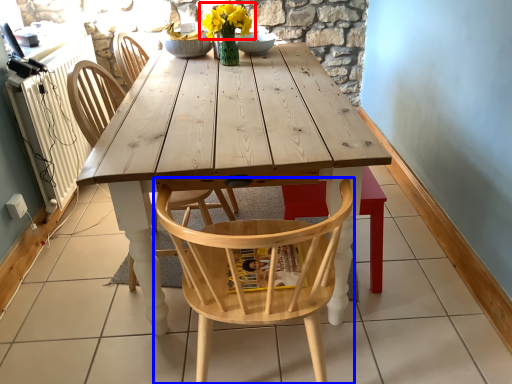
Question: Which object is further to the camera taking this photo, flower (highlighted by a red box) or chair (highlighted by a blue box)?

Choices:
 (A) flower
 (B) chair

Answer: (A)